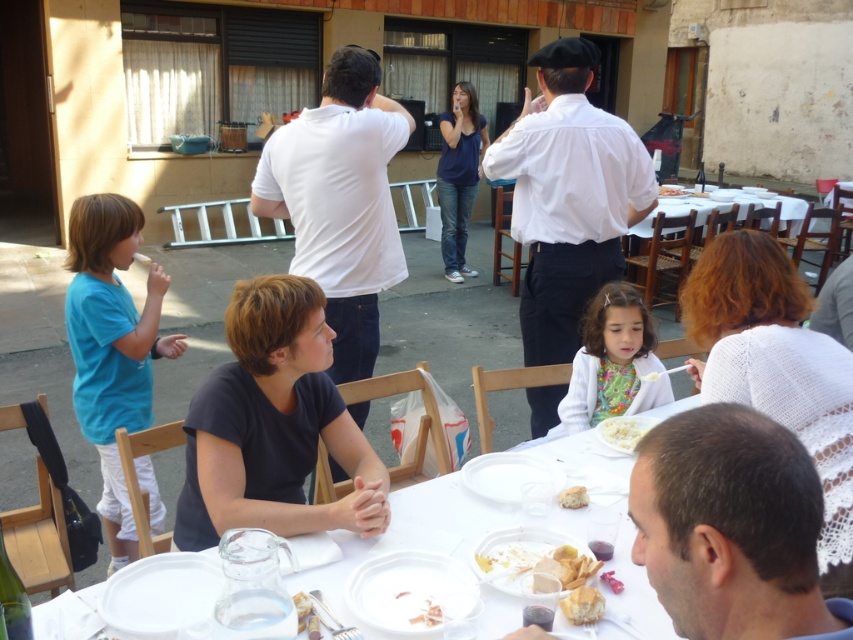
You are a photographer taking a picture of the white cotton shirt at center and the smooth white cheese at lower center. Which object should you focus on first if you want to capture both in the same frame without moving the camera?

The white cotton shirt at center is above the smooth white cheese at lower center, so you should focus on the smooth white cheese at lower center first as it is closer to the camera.

You are a guest at the outdoor dining event and want to reach the white crumbly bread at lower center without touching the white plastic table at center. Is this possible?

The white plastic table at center is above the white crumbly bread at lower center, so you can reach the bread by moving under the table or around it without touching the table.